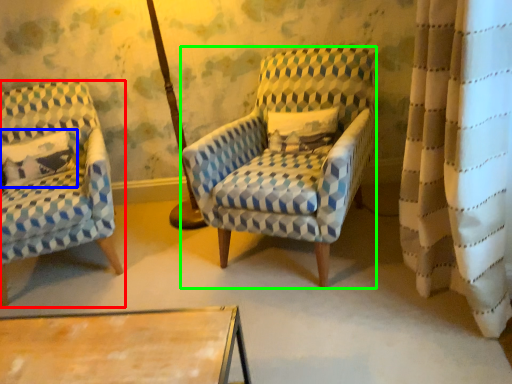
Question: Considering the real-world distances, which object is farthest from chair (highlighted by a red box)? pillow (highlighted by a blue box) or chair (highlighted by a green box)?

Choices:
 (A) pillow
 (B) chair

Answer: (B)